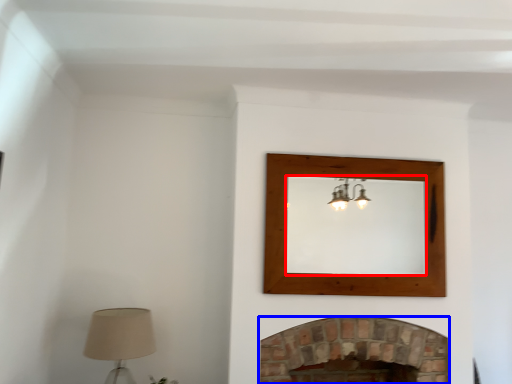
Question: Among these objects, which one is nearest to the camera, mirror (highlighted by a red box) or fireplace (highlighted by a blue box)?

Choices:
 (A) mirror
 (B) fireplace

Answer: (B)